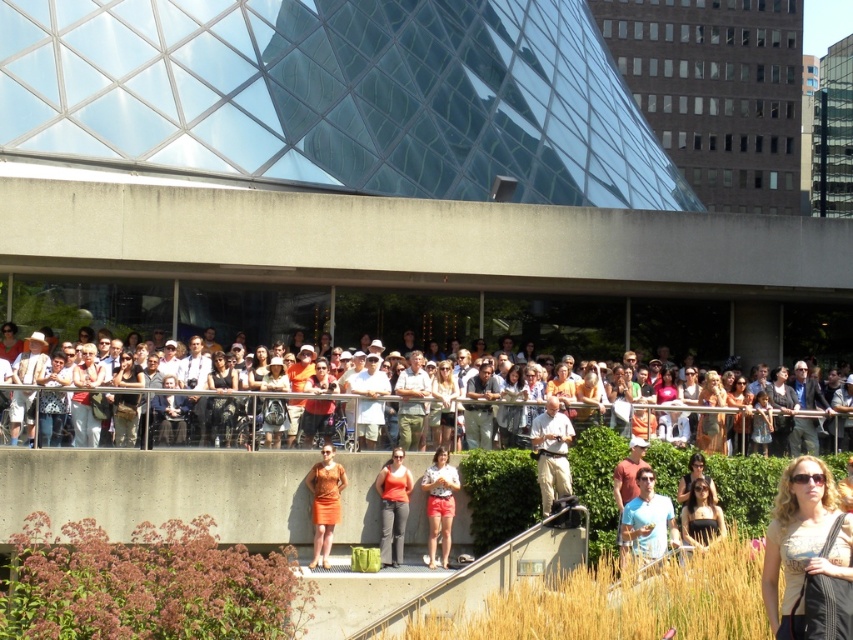
I want to click on matte orange shorts at center, so click(x=439, y=502).

Does matte orange shorts at center have a larger size compared to matte orange dress at lower right?

Yes, matte orange shorts at center is bigger than matte orange dress at lower right.

Identify the location of matte orange shorts at center. This screenshot has width=853, height=640. (439, 502).

Looking at this image, can you confirm if matte white crowd at center is taller than matte orange shorts at center?

Indeed, matte white crowd at center has a greater height compared to matte orange shorts at center.

Which of these two, matte white crowd at center or matte orange shorts at center, stands taller?

matte white crowd at center is taller.

At what (x,y) coordinates should I click in order to perform the action: click on matte white crowd at center. Please return your answer as a coordinate pair (x, y). Looking at the image, I should click on (268, 396).

Where is `matte white crowd at center`? The height and width of the screenshot is (640, 853). matte white crowd at center is located at coordinates coord(268,396).

From the picture: Can you confirm if khaki pants at center is positioned to the right of orange fabric dress at center?

Correct, you'll find khaki pants at center to the right of orange fabric dress at center.

Describe the element at coordinates (552, 452) in the screenshot. Image resolution: width=853 pixels, height=640 pixels. I see `khaki pants at center` at that location.

Is point (544, 406) farther from camera compared to point (338, 467)?

Yes, it is.

The image size is (853, 640). I want to click on khaki pants at center, so click(x=552, y=452).